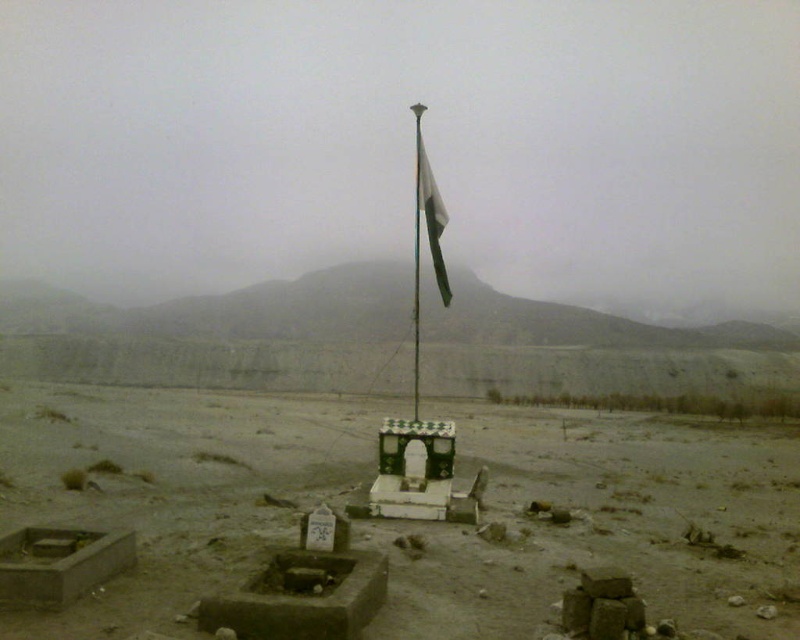
Does white fabric flag at center appear on the right side of metallic flag pole at center?

Indeed, white fabric flag at center is positioned on the right side of metallic flag pole at center.

The width and height of the screenshot is (800, 640). What are the coordinates of `white fabric flag at center` in the screenshot? It's located at (432, 214).

Identify the location of white fabric flag at center. The width and height of the screenshot is (800, 640). (432, 214).

Which of these two, white glossy flag pole at center or white fabric flag at center, stands shorter?

white fabric flag at center is shorter.

Does white glossy flag pole at center appear on the left side of white fabric flag at center?

Correct, you'll find white glossy flag pole at center to the left of white fabric flag at center.

Find the location of `white glossy flag pole at center`. white glossy flag pole at center is located at coordinates (428, 237).

Where is `white glossy flag pole at center`? Image resolution: width=800 pixels, height=640 pixels. white glossy flag pole at center is located at coordinates point(428,237).

In the scene shown: Can you confirm if white glossy flag pole at center is positioned to the left of metallic flag pole at center?

Incorrect, white glossy flag pole at center is not on the left side of metallic flag pole at center.

Is point (414, 108) more distant than point (416, 397)?

No, (414, 108) is closer to viewer.

Identify the location of white glossy flag pole at center. (428, 237).